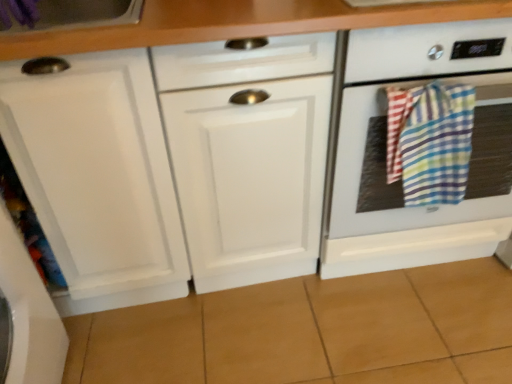
Question: In terms of width, does white glossy oven at right look wider or thinner when compared to multicolored plaid towel at right?

Choices:
 (A) wide
 (B) thin

Answer: (A)

Question: Does point (333, 253) appear closer or farther from the camera than point (394, 99)?

Choices:
 (A) closer
 (B) farther

Answer: (B)

Question: Is white glossy oven at right situated inside multicolored plaid towel at right or outside?

Choices:
 (A) outside
 (B) inside

Answer: (A)

Question: Is multicolored plaid towel at right bigger or smaller than white glossy oven at right?

Choices:
 (A) small
 (B) big

Answer: (A)

Question: Is multicolored plaid towel at right taller or shorter than white glossy oven at right?

Choices:
 (A) tall
 (B) short

Answer: (B)

Question: Is multicolored plaid towel at right inside the boundaries of white glossy oven at right, or outside?

Choices:
 (A) outside
 (B) inside

Answer: (A)

Question: Is point (414, 170) positioned closer to the camera than point (345, 211)?

Choices:
 (A) closer
 (B) farther

Answer: (A)